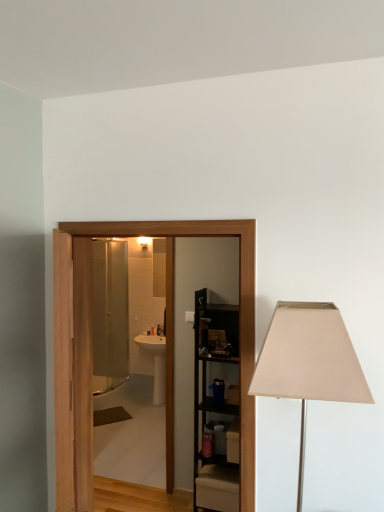
The width and height of the screenshot is (384, 512). In order to click on black metal shelving unit at center in this screenshot , I will do `click(215, 408)`.

The image size is (384, 512). In order to click on wooden door at center in this screenshot , I will do `click(91, 346)`.

What is the approximate height of beige fabric lampshade at right?

34.63 inches.

Find the location of a particular element. white glossy sink at center is located at coordinates (156, 362).

Identify the location of black metal shelving unit at center. This screenshot has height=512, width=384. (215, 408).

Which point is more distant from viewer, (171,413) or (159,347)?

Positioned behind is point (159,347).

In terms of size, does wooden door at center appear bigger or smaller than white glossy sink at center?

Clearly, wooden door at center is larger in size than white glossy sink at center.

Is wooden door at center facing away from white glossy sink at center?

That's not correct — wooden door at center is not looking away from white glossy sink at center.

What's the angular difference between wooden door at center and white glossy sink at center's facing directions?

The facing directions of wooden door at center and white glossy sink at center are 89.7 degrees apart.

Which of these two, white glossy sink at center or beige fabric lampshade at right, stands shorter?

white glossy sink at center is shorter.

Can you confirm if white glossy sink at center is wider than beige fabric lampshade at right?

No, white glossy sink at center is not wider than beige fabric lampshade at right.

Which object is more forward, white glossy sink at center or beige fabric lampshade at right?

beige fabric lampshade at right is in front.

Is wooden door at center oriented towards black metal shelving unit at center?

No, wooden door at center is not oriented towards black metal shelving unit at center.

Consider the image. Which point is more forward, (82, 473) or (208, 473)?

The point (82, 473) is in front.

Considering the relative positions of wooden door at center and black metal shelving unit at center in the image provided, is wooden door at center to the left of black metal shelving unit at center from the viewer's perspective?

Indeed, wooden door at center is positioned on the left side of black metal shelving unit at center.

Considering the relative sizes of white glossy sink at center and wooden door at center in the image provided, is white glossy sink at center shorter than wooden door at center?

Indeed, white glossy sink at center has a lesser height compared to wooden door at center.

Considering the positions of objects white glossy sink at center and wooden door at center in the image provided, who is more to the right, white glossy sink at center or wooden door at center?

wooden door at center.

Which is further, [159,337] or [244,441]?

The point [159,337] is behind.

From the image's perspective, which one is positioned lower, white glossy sink at center or wooden door at center?

white glossy sink at center.

Can you confirm if black metal shelving unit at center is taller than white glossy sink at center?

Yes.

Is point (237, 444) closer to camera compared to point (154, 385)?

That is True.

Considering the sizes of objects black metal shelving unit at center and white glossy sink at center in the image provided, who is bigger, black metal shelving unit at center or white glossy sink at center?

Bigger between the two is black metal shelving unit at center.

Is beige fabric lampshade at right turned away from black metal shelving unit at center?

No, beige fabric lampshade at right is not facing away from black metal shelving unit at center.

How distant is beige fabric lampshade at right from black metal shelving unit at center?

beige fabric lampshade at right and black metal shelving unit at center are 6.33 feet apart.

In the scene shown: Does beige fabric lampshade at right touch black metal shelving unit at center?

No, beige fabric lampshade at right is not in contact with black metal shelving unit at center.

From the picture: How different are the orientations of beige fabric lampshade at right and black metal shelving unit at center in degrees?

87.5 degrees separate the facing orientations of beige fabric lampshade at right and black metal shelving unit at center.

This screenshot has height=512, width=384. I want to click on barn door below the beige fabric lampshade at right (from a real-world perspective), so click(x=91, y=346).

Is wooden door at center positioned beyond the bounds of beige fabric lampshade at right?

That's correct, wooden door at center is outside of beige fabric lampshade at right.

Does wooden door at center turn towards beige fabric lampshade at right?

No, wooden door at center does not turn towards beige fabric lampshade at right.

From the image's perspective, is wooden door at center above or below beige fabric lampshade at right?

From the image's perspective, wooden door at center appears below beige fabric lampshade at right.

This screenshot has width=384, height=512. I want to click on barn door on the right of white glossy sink at center, so click(91, 346).

Identify the location of sink behind the beige fabric lampshade at right. The width and height of the screenshot is (384, 512). (156, 362).

Estimate the real-world distances between objects in this image. Which object is further from black metal shelving unit at center, white glossy sink at center or wooden door at center?

white glossy sink at center lies further to black metal shelving unit at center than the other object.

Considering their positions, is white glossy sink at center positioned further to beige fabric lampshade at right than black metal shelving unit at center?

white glossy sink at center lies further to beige fabric lampshade at right than the other object.

Considering their positions, is beige fabric lampshade at right positioned closer to black metal shelving unit at center than wooden door at center?

The object closer to black metal shelving unit at center is wooden door at center.

From the image, which object appears to be farther from white glossy sink at center, black metal shelving unit at center or beige fabric lampshade at right?

beige fabric lampshade at right.

When comparing their distances from white glossy sink at center, does wooden door at center or black metal shelving unit at center seem closer?

Among the two, black metal shelving unit at center is located nearer to white glossy sink at center.

Looking at the image, which one is located further to black metal shelving unit at center, beige fabric lampshade at right or white glossy sink at center?

beige fabric lampshade at right is further to black metal shelving unit at center.

Based on their spatial positions, is wooden door at center or black metal shelving unit at center further from beige fabric lampshade at right?

black metal shelving unit at center lies further to beige fabric lampshade at right than the other object.

Based on their spatial positions, is beige fabric lampshade at right or black metal shelving unit at center further from white glossy sink at center?

Based on the image, beige fabric lampshade at right appears to be further to white glossy sink at center.

Where is `barn door positioned between beige fabric lampshade at right and black metal shelving unit at center from near to far`? Image resolution: width=384 pixels, height=512 pixels. barn door positioned between beige fabric lampshade at right and black metal shelving unit at center from near to far is located at coordinates (91, 346).

Find the location of `cabinetry positioned between wooden door at center and white glossy sink at center from near to far`. cabinetry positioned between wooden door at center and white glossy sink at center from near to far is located at coordinates (215, 408).

You are a GUI agent. You are given a task and a screenshot of the screen. Output one action in this format:
    pyautogui.click(x=<x>, y=<y>)
    Task: Click on the cabinetry between beige fabric lampshade at right and white glossy sink at center from front to back
    
    Given the screenshot: What is the action you would take?
    pos(215,408)

Where is `barn door located between beige fabric lampshade at right and white glossy sink at center in the depth direction`? The width and height of the screenshot is (384, 512). barn door located between beige fabric lampshade at right and white glossy sink at center in the depth direction is located at coordinates [x=91, y=346].